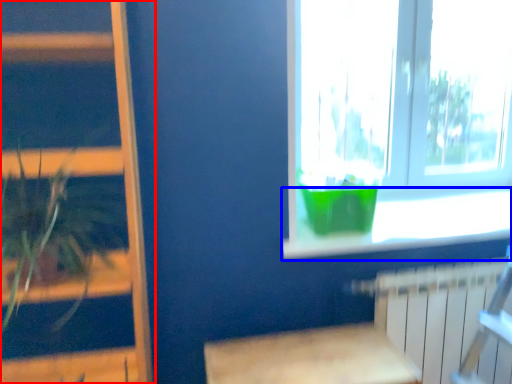
Question: Which object is closer to the camera taking this photo, bookshelf (highlighted by a red box) or window sill (highlighted by a blue box)?

Choices:
 (A) bookshelf
 (B) window sill

Answer: (A)